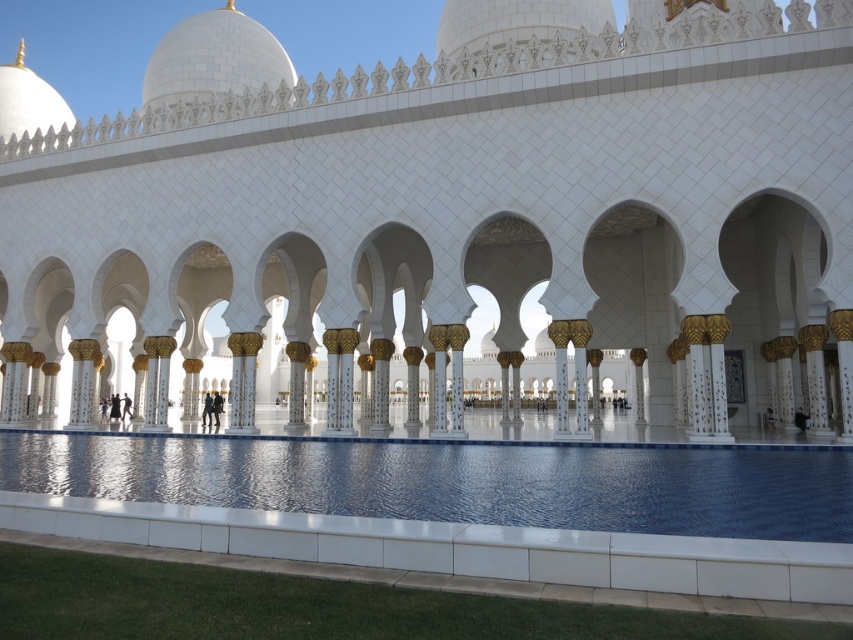
Can you confirm if white marble palace at center is shorter than blue glossy water at center?

In fact, white marble palace at center may be taller than blue glossy water at center.

Is point (202, 140) closer to camera compared to point (631, 508)?

No, it is behind (631, 508).

This screenshot has width=853, height=640. I want to click on white marble palace at center, so click(x=463, y=216).

What do you see at coordinates (457, 508) in the screenshot? I see `blue glossy water at center` at bounding box center [457, 508].

Between point (277, 532) and point (267, 38), which one is positioned behind?

The point (267, 38) is more distant.

Which is in front, point (73, 467) or point (277, 52)?

Point (73, 467)

Identify the location of blue glossy water at center. (457, 508).

In the scene shown: Can you confirm if white marble palace at center is positioned to the right of white marble dome at upper center?

Yes, white marble palace at center is to the right of white marble dome at upper center.

Identify the location of white marble palace at center. The width and height of the screenshot is (853, 640). (463, 216).

Which is behind, point (630, 381) or point (218, 64)?

Point (630, 381)

Find the location of `white marble palace at center`. white marble palace at center is located at coordinates (463, 216).